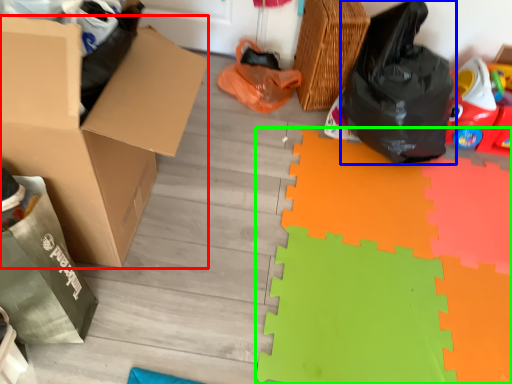
Question: Which object is positioned farthest from box (highlighted by a red box)? Select from plastic bag (highlighted by a blue box) and doormat (highlighted by a green box).

Choices:
 (A) plastic bag
 (B) doormat

Answer: (A)